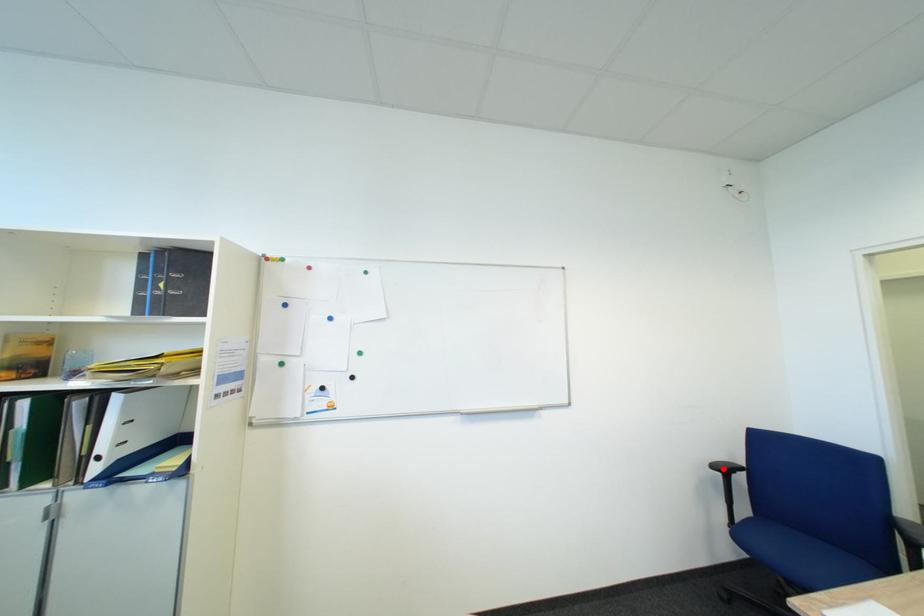
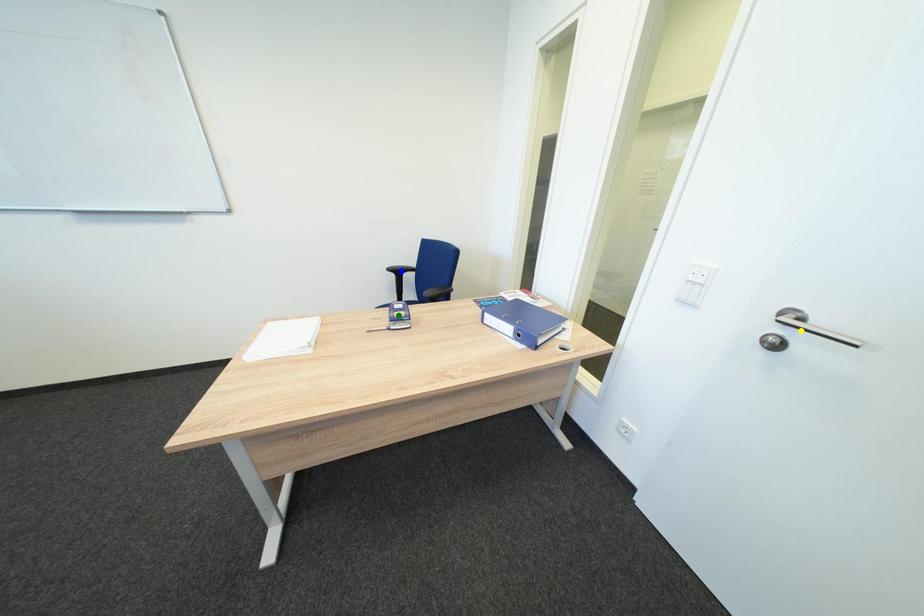
Question: I am providing you with two images of the same scene from different viewpoints. A red point is marked on the first image. You are given multiple points on the second image. Can you choose the point in image 2 that corresponds to the point in image 1?

Choices:
 (A) green point
 (B) blue point
 (C) yellow point

Answer: (B)